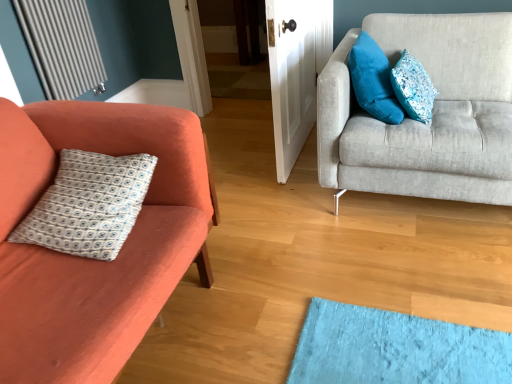
Question: From the image's perspective, is metallic silver radiator at upper left positioned above or below white printed fabric pillow at left, acting as the third pillow starting from the right?

Choices:
 (A) above
 (B) below

Answer: (A)

Question: Looking at the image, does metallic silver radiator at upper left seem bigger or smaller compared to white printed fabric pillow at left, the first pillow in the left-to-right sequence?

Choices:
 (A) small
 (B) big

Answer: (A)

Question: Which is nearer to the white glossy door at center?

Choices:
 (A) white printed fabric pillow at left, the first pillow in the left-to-right sequence
 (B) matte orange couch at left, arranged as the 1th studio couch when viewed from the left
 (C) blue textured pillow at upper right, the 1th pillow from the right
 (D) light gray fabric couch at right, which appears as the second studio couch when viewed from the left
 (E) metallic silver radiator at upper left

Answer: (D)

Question: Estimate the real-world distances between objects in this image. Which object is farther from the blue textured pillow at upper right, the 1th pillow from the right?

Choices:
 (A) metallic silver radiator at upper left
 (B) velvety blue pillow at upper right, which is counted as the 2th pillow, starting from the left
 (C) light gray fabric couch at right, which appears as the second studio couch when viewed from the left
 (D) white glossy door at center
 (E) matte orange couch at left, marked as the 2th studio couch in a right-to-left arrangement

Answer: (A)